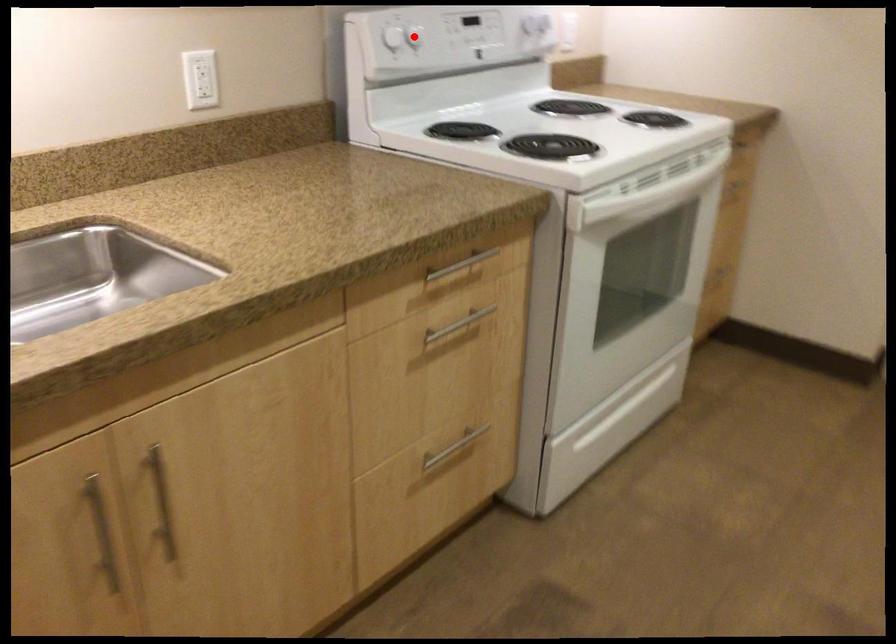
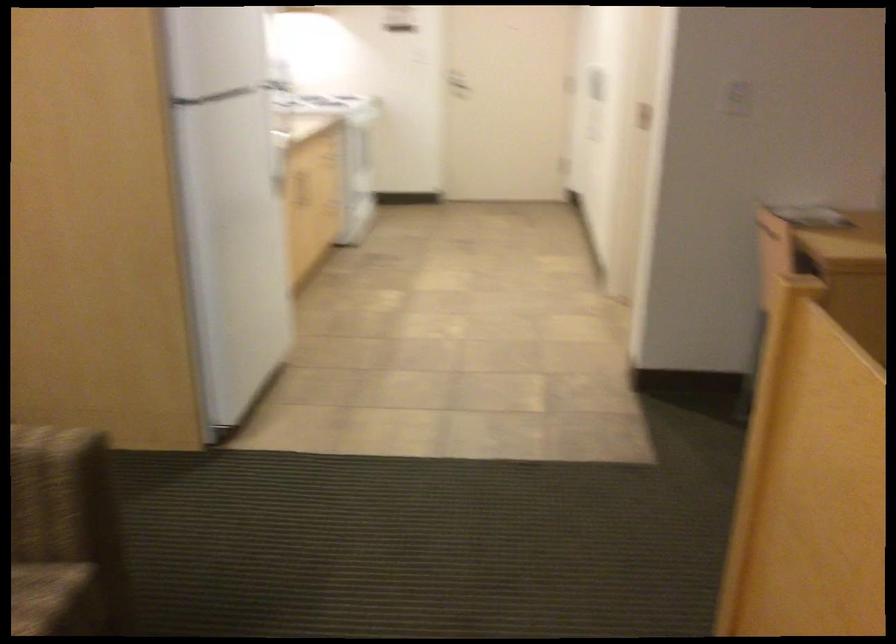
Question: I am providing you with two images of the same scene from different viewpoints. A red point is marked on the first image. Is the red point's position out of view in image 2?

Choices:
 (A) Yes
 (B) No

Answer: (A)